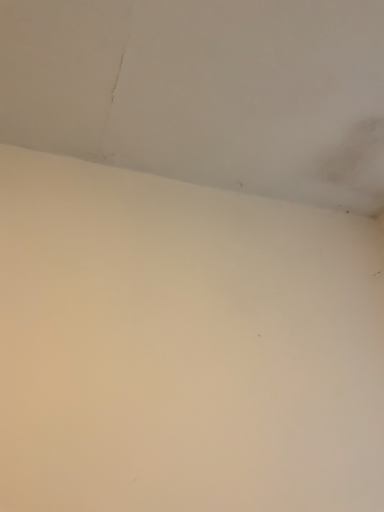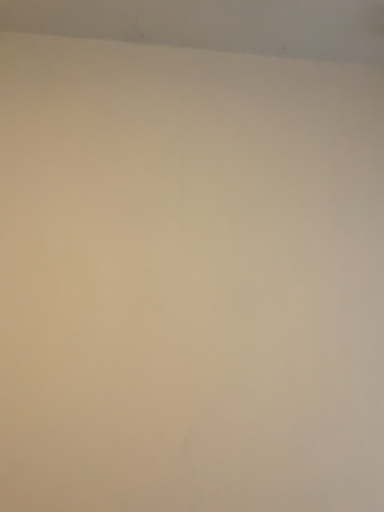
Question: How did the camera likely rotate when shooting the video?

Choices:
 (A) rotated right
 (B) rotated left

Answer: (B)